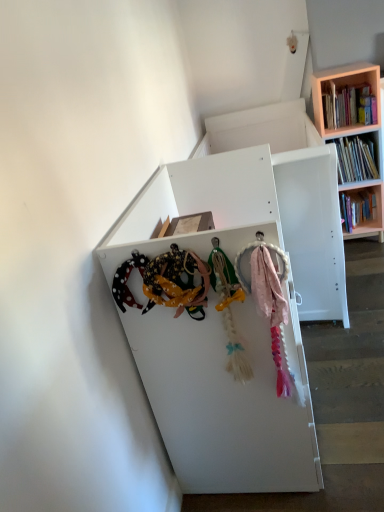
Find the location of a particular element. Image resolution: width=384 pixels, height=512 pixels. vacant area located to the right-hand side of white matte shelf at center is located at coordinates (341, 374).